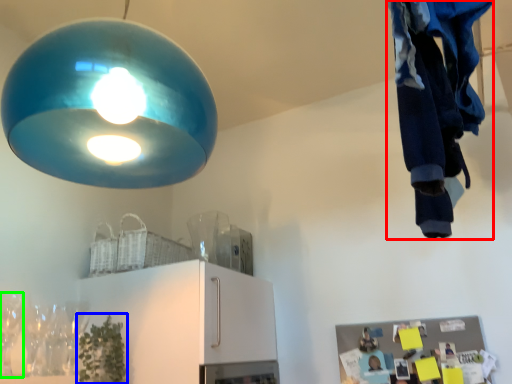
Question: Based on their relative distances, which object is farther from clothing (highlighted by a red box)? Choose from plant (highlighted by a blue box) and wine glass (highlighted by a green box).

Choices:
 (A) plant
 (B) wine glass

Answer: (B)